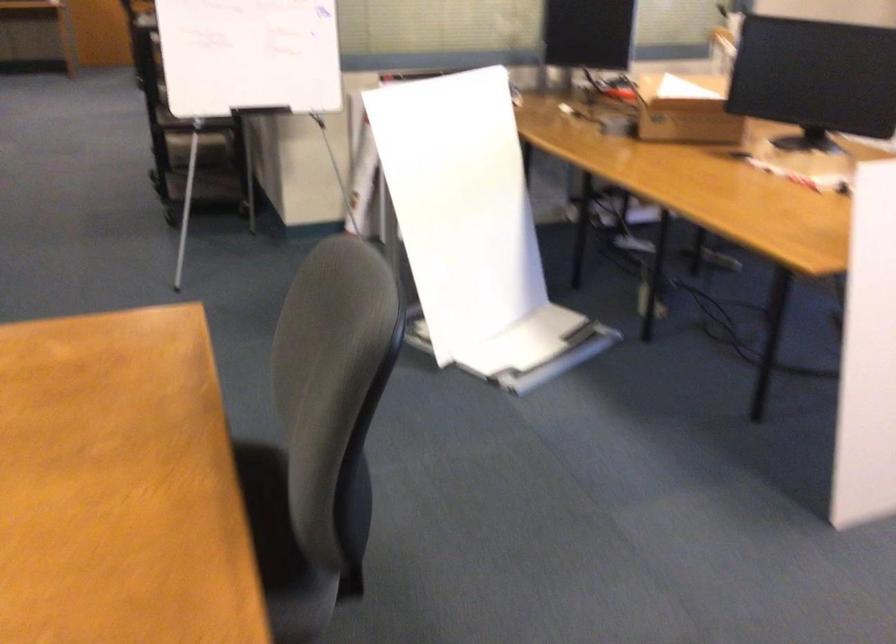
Where is `grey chair sitting surface`? grey chair sitting surface is located at coordinates (261, 485).